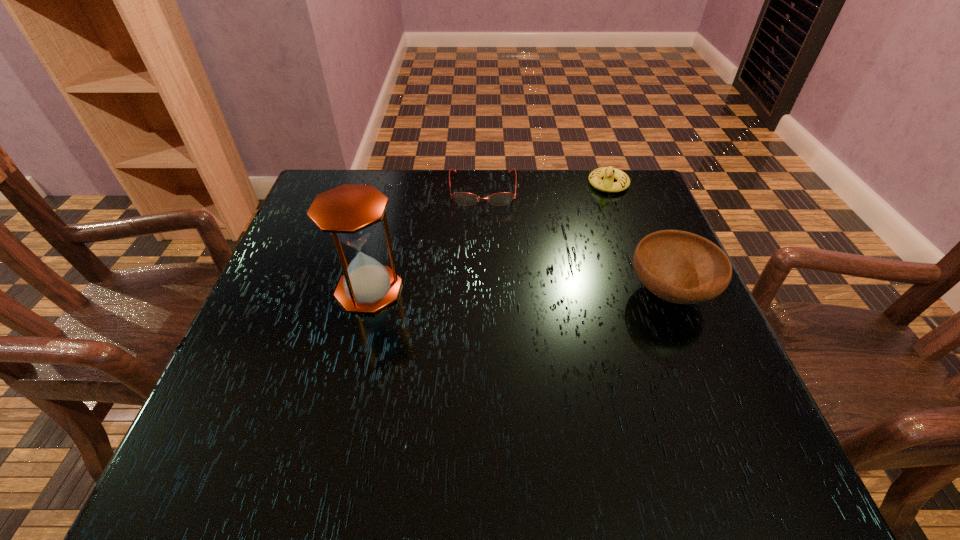
The image size is (960, 540). What are the coordinates of `hourglass` in the screenshot? It's located at (350, 213).

Image resolution: width=960 pixels, height=540 pixels. I want to click on the tallest object, so click(x=350, y=213).

Where is `bowl`? The width and height of the screenshot is (960, 540). bowl is located at coordinates (681, 267).

You are a GUI agent. You are given a task and a screenshot of the screen. Output one action in this format:
    pyautogui.click(x=<x>, y=<y>)
    Task: Click on the duckling
    Image resolution: width=960 pixels, height=540 pixels.
    Given the screenshot: What is the action you would take?
    pyautogui.click(x=609, y=173)

Find the location of `the shortest object`. the shortest object is located at coordinates (463, 198).

This screenshot has width=960, height=540. Identify the location of spectacles. tap(463, 198).

Where is `vacant region located 0.150m on the left of the hourglass`? vacant region located 0.150m on the left of the hourglass is located at coordinates (266, 290).

You are a GUI agent. You are given a task and a screenshot of the screen. Output one action in this format:
    pyautogui.click(x=<x>, y=<y>)
    Task: Click on the free space located on the front of the second tallest object
    
    Given the screenshot: What is the action you would take?
    pyautogui.click(x=694, y=352)

The image size is (960, 540). What are the coordinates of `free location located on the face of the third tallest object` in the screenshot? It's located at (577, 246).

Identify the location of vacant space located 0.210m on the face of the third tallest object. tap(580, 241).